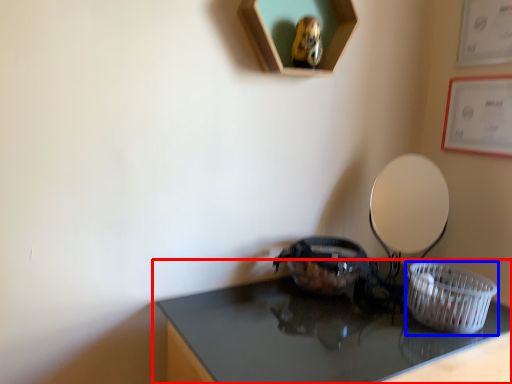
Question: Among these objects, which one is farthest to the camera, table (highlighted by a red box) or basket (highlighted by a blue box)?

Choices:
 (A) table
 (B) basket

Answer: (B)